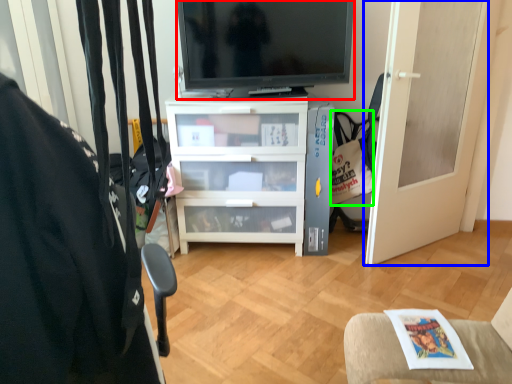
Question: Considering the real-world distances, which object is farthest from television (highlighted by a red box)? door (highlighted by a blue box) or handbag (highlighted by a green box)?

Choices:
 (A) door
 (B) handbag

Answer: (A)